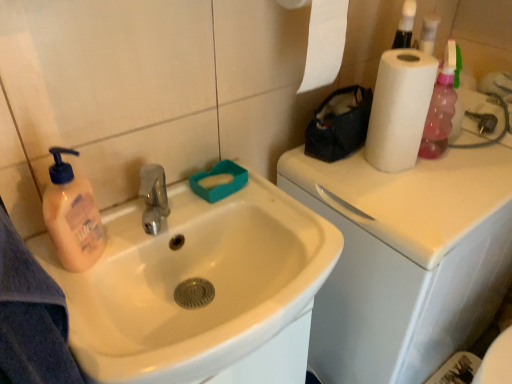
Question: Is white glossy counter top at upper right positioned far away from white glossy sink at left?

Choices:
 (A) yes
 (B) no

Answer: (B)

Question: Is white glossy counter top at upper right not inside white glossy sink at left?

Choices:
 (A) yes
 (B) no

Answer: (A)

Question: Considering the relative positions of white glossy counter top at upper right and white glossy sink at left in the image provided, is white glossy counter top at upper right to the right of white glossy sink at left from the viewer's perspective?

Choices:
 (A) no
 (B) yes

Answer: (B)

Question: Considering the relative sizes of white glossy counter top at upper right and white glossy sink at left in the image provided, is white glossy counter top at upper right bigger than white glossy sink at left?

Choices:
 (A) yes
 (B) no

Answer: (A)

Question: Does white glossy counter top at upper right have a lesser width compared to white glossy sink at left?

Choices:
 (A) no
 (B) yes

Answer: (A)

Question: From the image's perspective, does white glossy counter top at upper right appear lower than white glossy sink at left?

Choices:
 (A) yes
 (B) no

Answer: (B)

Question: Can you confirm if white matte paper towel at upper right is wider than white glossy sink at left?

Choices:
 (A) no
 (B) yes

Answer: (A)

Question: From the image's perspective, is white matte paper towel at upper right above white glossy sink at left?

Choices:
 (A) yes
 (B) no

Answer: (A)

Question: From a real-world perspective, is white matte paper towel at upper right physically below white glossy sink at left?

Choices:
 (A) yes
 (B) no

Answer: (B)

Question: Is the position of white matte paper towel at upper right less distant than that of white glossy sink at left?

Choices:
 (A) yes
 (B) no

Answer: (B)

Question: Considering the relative sizes of white matte paper towel at upper right and white glossy sink at left in the image provided, is white matte paper towel at upper right bigger than white glossy sink at left?

Choices:
 (A) no
 (B) yes

Answer: (A)

Question: Is white matte paper towel at upper right turned away from white glossy sink at left?

Choices:
 (A) no
 (B) yes

Answer: (A)

Question: Is white glossy sink at left facing towards white matte paper towel at upper right?

Choices:
 (A) no
 (B) yes

Answer: (A)